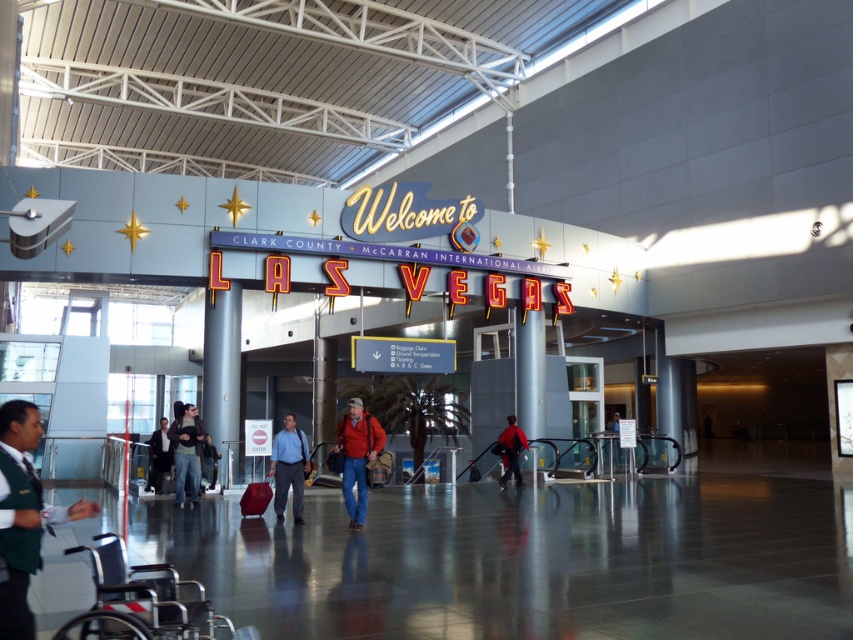
You are standing at the entrance of the airport terminal and see the jeans at center. If you walk straight ahead, will you reach the Welcome to LAS VEGAS sign first or the exit doors? Please explain your reasoning based on their positions.

The jeans at center is located at point (x=187, y=451). Since the Welcome to LAS VEGAS sign is the focal point in the image, it is positioned centrally and closer to the entrance. Therefore, walking straight ahead would reach the Welcome to LAS VEGAS sign before the exit doors.

You are a traveler standing at the entrance of Clark County McCarran International Airport, looking towards the Welcome to LAS VEGAS sign. You see a smooth gray pillar at center and a red matte jacket at center. Which object is positioned to the right of the other?

The smooth gray pillar at center is to the right of the red matte jacket at center.